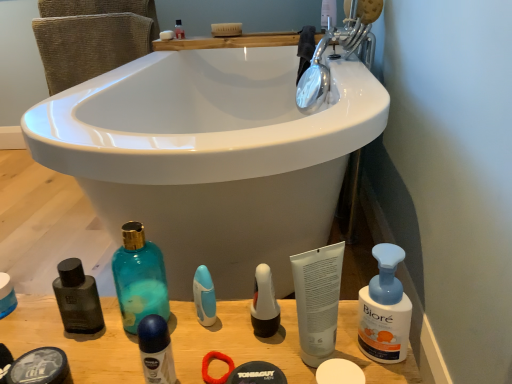
Where is `free point above wooden counter top at lower center (from a real-world perspective)`? free point above wooden counter top at lower center (from a real-world perspective) is located at coordinates (135, 336).